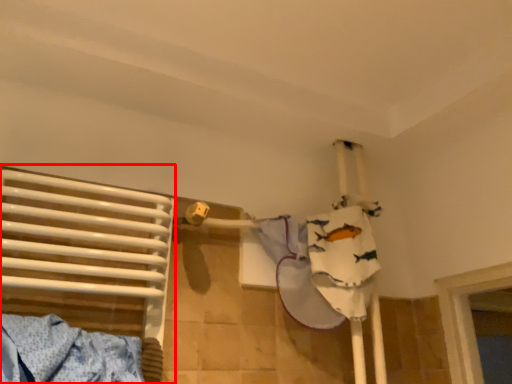
Question: From the image's perspective, considering the relative positions of bed (annotated by the red box) and clothing in the image provided, where is bed (annotated by the red box) located with respect to the staircase?

Choices:
 (A) above
 (B) below

Answer: (A)